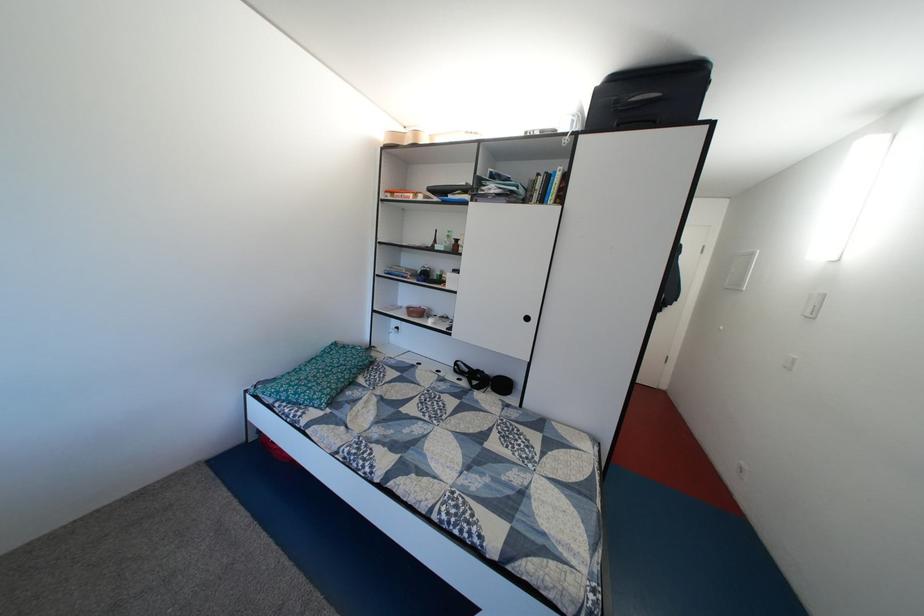
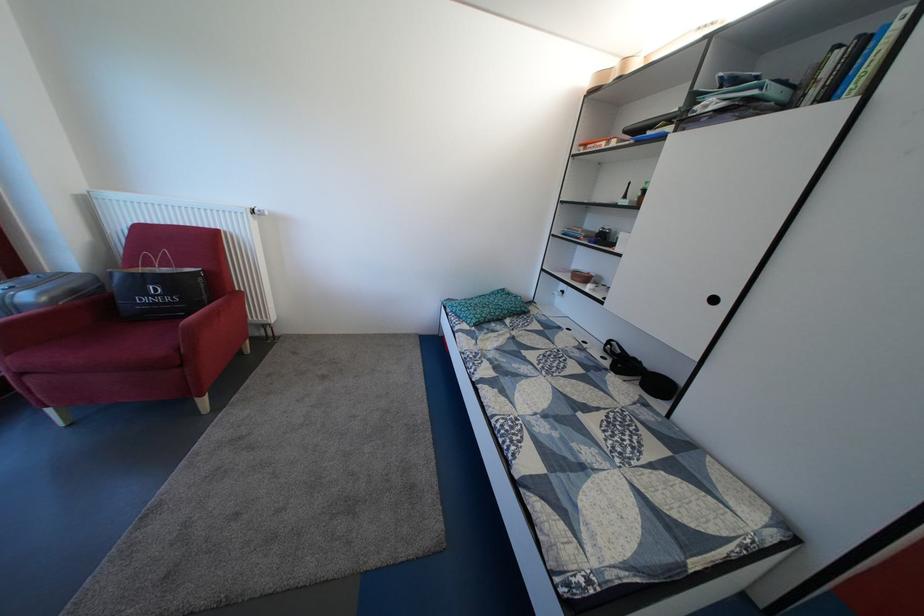
Question: How did the camera likely rotate?

Choices:
 (A) Left
 (B) Right
 (C) Up
 (D) Down

Answer: (A)